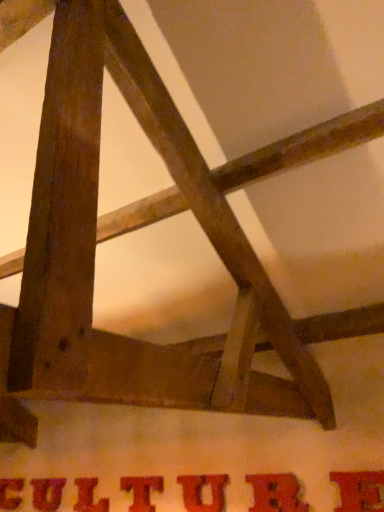
Question: In which direction should I rotate to look at matte brown letter t at center, the 4th letter in the left-to-right sequence?

Choices:
 (A) right
 (B) left

Answer: (B)

Question: Does matte brown letter t at center, which appears as the 4th letter when viewed from the right, have a lesser width compared to matte red letter at center, which is the third letter in left-to-right order?

Choices:
 (A) yes
 (B) no

Answer: (A)

Question: From the image's perspective, is matte brown letter t at center, the 4th letter in the left-to-right sequence, over matte red letter at center, marked as the fifth letter in a right-to-left arrangement?

Choices:
 (A) no
 (B) yes

Answer: (B)

Question: Does matte brown letter t at center, the 4th letter in the left-to-right sequence, have a greater height compared to matte red letter at center, which is the third letter in left-to-right order?

Choices:
 (A) no
 (B) yes

Answer: (A)

Question: Does matte brown letter t at center, which appears as the 4th letter when viewed from the right, appear on the left side of matte red letter at center, which is the third letter in left-to-right order?

Choices:
 (A) no
 (B) yes

Answer: (A)

Question: Could you tell me if matte brown letter t at center, the 4th letter in the left-to-right sequence, is facing matte red letter at center, marked as the fifth letter in a right-to-left arrangement?

Choices:
 (A) yes
 (B) no

Answer: (B)

Question: Can you confirm if matte brown letter t at center, which appears as the 4th letter when viewed from the right, is bigger than matte red letter at center, marked as the fifth letter in a right-to-left arrangement?

Choices:
 (A) no
 (B) yes

Answer: (B)

Question: Considering the relative sizes of matte red letter at center, which is the sixth letter from left to right, and matte brown letter t at center, the 4th letter in the left-to-right sequence, in the image provided, is matte red letter at center, which is the sixth letter from left to right, wider than matte brown letter t at center, the 4th letter in the left-to-right sequence,?

Choices:
 (A) no
 (B) yes

Answer: (A)

Question: From the image's perspective, is matte red letter at center, which is the sixth letter from left to right, under matte brown letter t at center, which appears as the 4th letter when viewed from the right?

Choices:
 (A) yes
 (B) no

Answer: (B)

Question: Considering the relative positions of matte red letter at center, which is the sixth letter from left to right, and matte brown letter t at center, the 4th letter in the left-to-right sequence, in the image provided, is matte red letter at center, which is the sixth letter from left to right, in front of matte brown letter t at center, the 4th letter in the left-to-right sequence,?

Choices:
 (A) yes
 (B) no

Answer: (A)

Question: Considering the relative sizes of matte red letter at center, which is the sixth letter from left to right, and matte brown letter t at center, which appears as the 4th letter when viewed from the right, in the image provided, is matte red letter at center, which is the sixth letter from left to right, shorter than matte brown letter t at center, which appears as the 4th letter when viewed from the right,?

Choices:
 (A) no
 (B) yes

Answer: (A)

Question: Does matte red letter at center, which is the second letter in right-to-left order, have a larger size compared to matte brown letter t at center, the 4th letter in the left-to-right sequence?

Choices:
 (A) yes
 (B) no

Answer: (A)

Question: Can we say matte red letter at center, which is the sixth letter from left to right, lies outside matte brown letter t at center, the 4th letter in the left-to-right sequence?

Choices:
 (A) yes
 (B) no

Answer: (A)

Question: Are matte red letter at center, which is the third letter in left-to-right order, and matte brown letter t at center, the 4th letter in the left-to-right sequence, far apart?

Choices:
 (A) no
 (B) yes

Answer: (A)